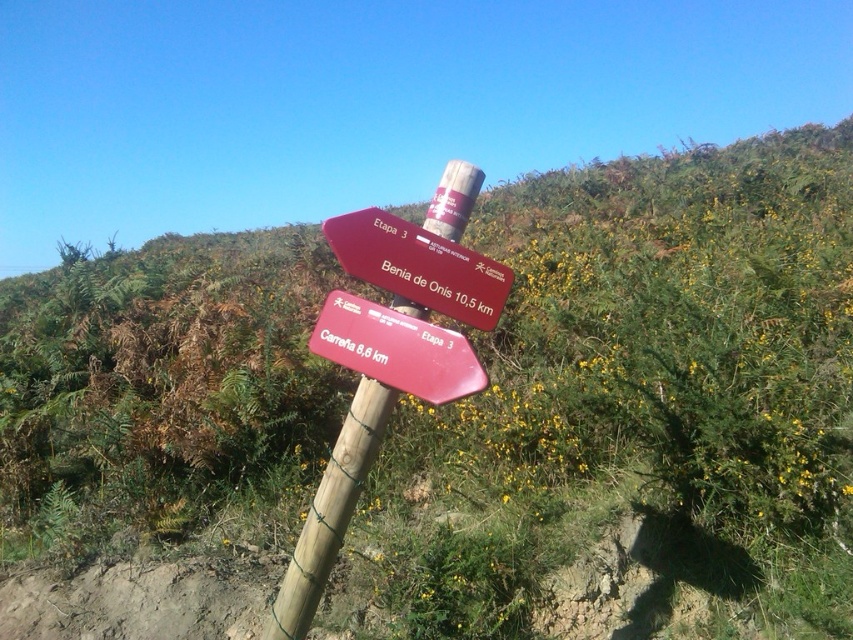
Question: Among these objects, which one is nearest to the camera?

Choices:
 (A) wooden post at center
 (B) red matte signpost at center

Answer: (B)

Question: Which point is farther from the camera taking this photo?

Choices:
 (A) (375, 244)
 (B) (306, 547)

Answer: (B)

Question: Can you confirm if wooden post at center is smaller than red plastic sign at center?

Choices:
 (A) no
 (B) yes

Answer: (A)

Question: Which of these objects is positioned closest to the red matte signpost at center?

Choices:
 (A) wooden post at center
 (B) red plastic sign at center

Answer: (B)

Question: Is red plastic sign at center thinner than red matte signpost at center?

Choices:
 (A) yes
 (B) no

Answer: (B)

Question: Is wooden post at center bigger than red plastic sign at center?

Choices:
 (A) no
 (B) yes

Answer: (B)